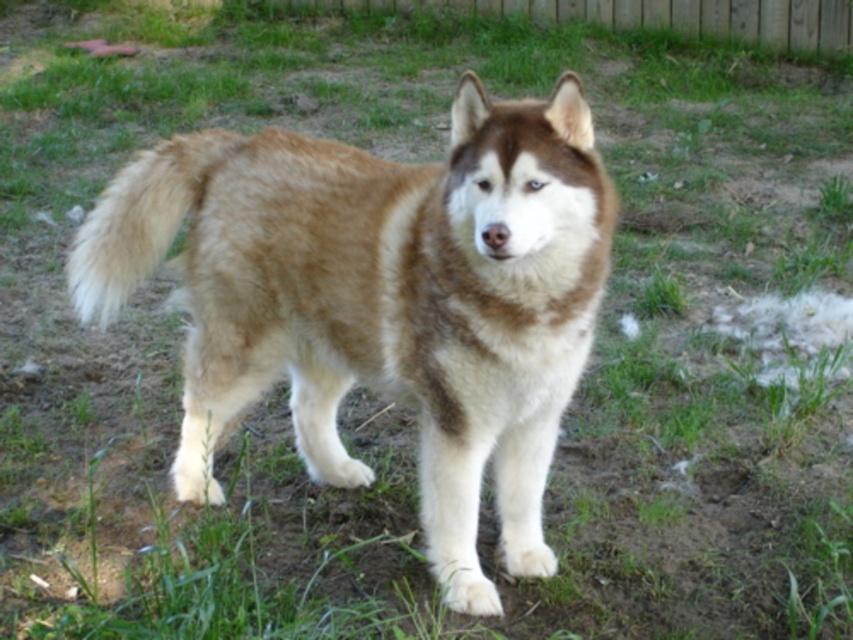
Question: Does fuzzy brown fur at rear appear on the right side of wooden fence at upper center?

Choices:
 (A) yes
 (B) no

Answer: (B)

Question: Which of these objects is positioned farthest from the wooden fence at upper center?

Choices:
 (A) brown/white fur dog at center
 (B) fuzzy brown fur at rear

Answer: (A)

Question: In this image, where is brown/white fur dog at center located relative to fuzzy brown fur at rear?

Choices:
 (A) left
 (B) right

Answer: (B)

Question: Based on their relative distances, which object is nearer to the wooden fence at upper center?

Choices:
 (A) fuzzy brown fur at rear
 (B) brown/white fur dog at center

Answer: (A)

Question: Which point is farther to the camera?

Choices:
 (A) wooden fence at upper center
 (B) fuzzy brown fur at rear
 (C) brown/white fur dog at center

Answer: (A)

Question: Is brown/white fur dog at center to the right of wooden fence at upper center from the viewer's perspective?

Choices:
 (A) no
 (B) yes

Answer: (A)